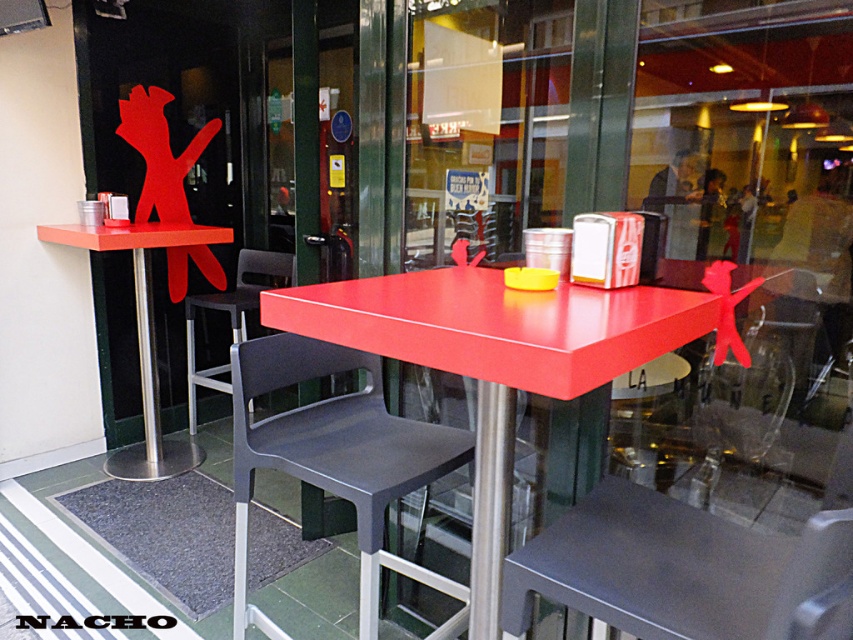
You are designing a layout for a small restaurant and need to place the matte black chair at center and the matte red table at left next to each other. Based on their widths, which one should be placed on the side with limited space?

The matte black chair at center has a smaller width than the matte red table at left, so it should be placed on the side with limited space.

You are a customer entering the cafe and want to sit at the matte red table at left. From your current position, which direction should you move relative to the metallic gray chair at lower center to reach the table?

The metallic gray chair at lower center is in front of the matte red table at left, so you should move backward away from the metallic gray chair at lower center to reach the matte red table at left.

You are a delivery person trying to place a large box between the matte red table at left and the black plastic chair at center. The box is 16 inches wide. Will there be enough space to fit the box between them?

The distance between the matte red table at left and the black plastic chair at center is 15.56 inches, which is slightly less than the box width of 16 inches. Therefore, the box will not fit between them.